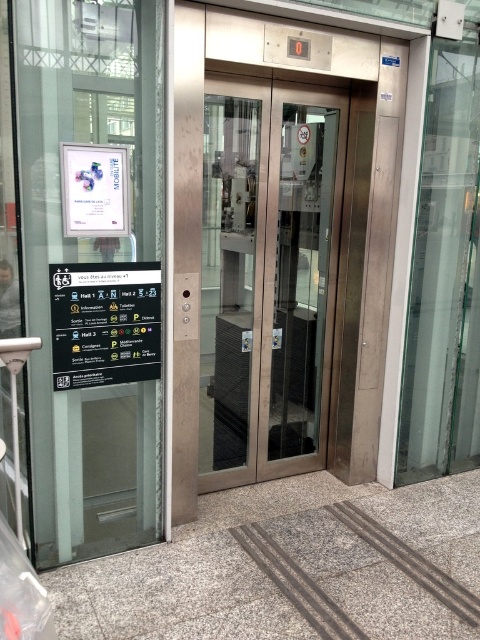
Question: Is transparent glass door at left to the left of satin silver elevator doors at center from the viewer's perspective?

Choices:
 (A) no
 (B) yes

Answer: (B)

Question: Observing the image, what is the correct spatial positioning of satin silver elevator doors at center in reference to transparent glass door at right?

Choices:
 (A) below
 (B) above

Answer: (A)

Question: Which point is farther from the camera taking this photo?

Choices:
 (A) (251, 196)
 (B) (98, 228)
 (C) (464, 148)

Answer: (C)

Question: Which point is farther to the camera?

Choices:
 (A) (323, 442)
 (B) (469, 74)

Answer: (A)

Question: Which of the following is the closest to the observer?

Choices:
 (A) satin silver elevator doors at center
 (B) transparent glass door at right

Answer: (A)

Question: Is transparent glass door at left below satin silver elevator doors at center?

Choices:
 (A) no
 (B) yes

Answer: (B)